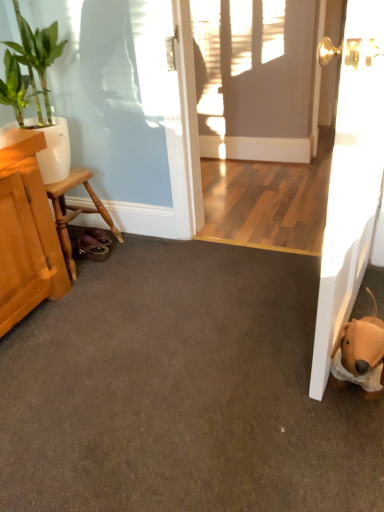
Question: Is white glossy door at right shorter than green glossy plant at upper left?

Choices:
 (A) no
 (B) yes

Answer: (A)

Question: From the image's perspective, is white glossy door at right beneath green glossy plant at upper left?

Choices:
 (A) yes
 (B) no

Answer: (A)

Question: Does white glossy door at right have a larger size compared to green glossy plant at upper left?

Choices:
 (A) no
 (B) yes

Answer: (A)

Question: Can you confirm if white glossy door at right is taller than green glossy plant at upper left?

Choices:
 (A) no
 (B) yes

Answer: (B)

Question: Considering the relative sizes of white glossy door at right and green glossy plant at upper left in the image provided, is white glossy door at right smaller than green glossy plant at upper left?

Choices:
 (A) yes
 (B) no

Answer: (A)

Question: In terms of height, does brown plush dog at lower right look taller or shorter compared to wooden stool at left?

Choices:
 (A) short
 (B) tall

Answer: (A)

Question: Looking at their shapes, would you say brown plush dog at lower right is wider or thinner than wooden stool at left?

Choices:
 (A) wide
 (B) thin

Answer: (B)

Question: Visually, is brown plush dog at lower right positioned to the left or to the right of wooden stool at left?

Choices:
 (A) left
 (B) right

Answer: (B)

Question: Relative to wooden stool at left, is brown plush dog at lower right in front or behind?

Choices:
 (A) front
 (B) behind

Answer: (A)

Question: From a real-world perspective, is white glossy door at right positioned above or below green glossy plant at upper left?

Choices:
 (A) below
 (B) above

Answer: (A)

Question: Is white glossy door at right inside the boundaries of green glossy plant at upper left, or outside?

Choices:
 (A) outside
 (B) inside

Answer: (A)

Question: Would you say white glossy door at right is to the left or to the right of green glossy plant at upper left in the picture?

Choices:
 (A) right
 (B) left

Answer: (A)

Question: In terms of height, does white glossy door at right look taller or shorter compared to green glossy plant at upper left?

Choices:
 (A) tall
 (B) short

Answer: (A)

Question: Is white glossy door at right situated inside wooden stool at left or outside?

Choices:
 (A) inside
 (B) outside

Answer: (B)

Question: In terms of size, does white glossy door at right appear bigger or smaller than wooden stool at left?

Choices:
 (A) small
 (B) big

Answer: (B)